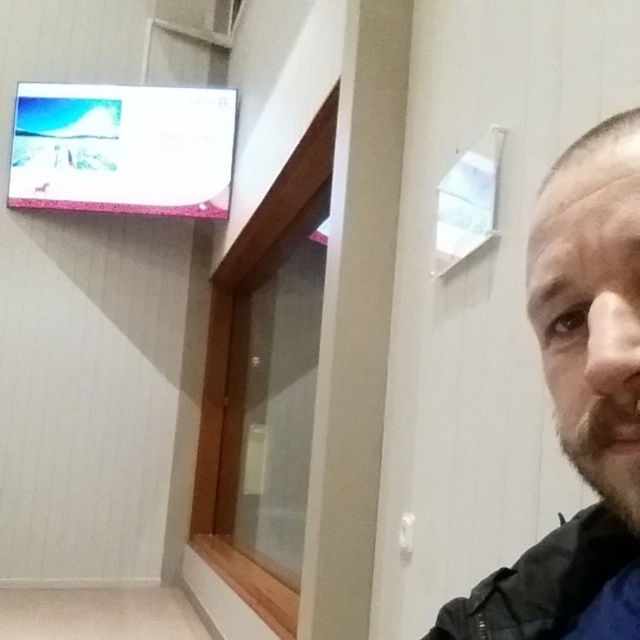
Can you confirm if black matte jacket at lower right is smaller than brown fuzzy beard at lower right?

No.

Where is `black matte jacket at lower right`? The height and width of the screenshot is (640, 640). black matte jacket at lower right is located at coordinates (541, 582).

What are the coordinates of `black matte jacket at lower right` in the screenshot? It's located at (541, 582).

The height and width of the screenshot is (640, 640). I want to click on black matte jacket at lower right, so click(x=541, y=582).

Locate an element on the screen. The width and height of the screenshot is (640, 640). bearded man at right is located at coordinates (579, 403).

Which is above, bearded man at right or black matte jacket at lower right?

bearded man at right is higher up.

Image resolution: width=640 pixels, height=640 pixels. What are the coordinates of `bearded man at right` in the screenshot? It's located at (579, 403).

Where is `bearded man at right`? bearded man at right is located at coordinates (579, 403).

At what (x,y) coordinates should I click in order to perform the action: click on bearded man at right. Please return your answer as a coordinate pair (x, y). The width and height of the screenshot is (640, 640). Looking at the image, I should click on (579, 403).

Can you confirm if bearded man at right is bigger than brown fuzzy beard at lower right?

Correct, bearded man at right is larger in size than brown fuzzy beard at lower right.

Between point (624, 524) and point (595, 474), which one is positioned behind?

The point (624, 524) is more distant.

Locate an element on the screen. The image size is (640, 640). bearded man at right is located at coordinates (579, 403).